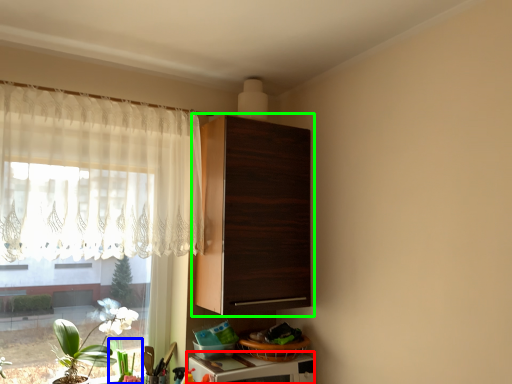
Question: Which object is positioned farthest from appliance (highlighted by a red box)? Select from plant (highlighted by a blue box) and cabinetry (highlighted by a green box).

Choices:
 (A) plant
 (B) cabinetry

Answer: (B)